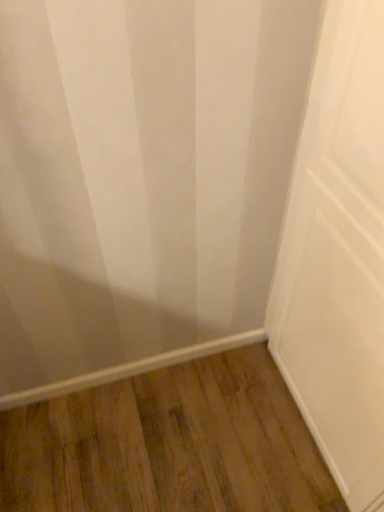
Question: From a real-world perspective, is brown wood flooring at lower center above or below white matte door at center?

Choices:
 (A) below
 (B) above

Answer: (A)

Question: Would you say brown wood flooring at lower center is to the left or to the right of white matte door at center in the picture?

Choices:
 (A) left
 (B) right

Answer: (A)

Question: Is brown wood flooring at lower center wider or thinner than white matte door at center?

Choices:
 (A) thin
 (B) wide

Answer: (B)

Question: Considering the positions of white matte door at center and brown wood flooring at lower center in the image, is white matte door at center bigger or smaller than brown wood flooring at lower center?

Choices:
 (A) small
 (B) big

Answer: (B)

Question: Is white matte door at center wider or thinner than brown wood flooring at lower center?

Choices:
 (A) thin
 (B) wide

Answer: (A)

Question: Is point (360, 148) positioned closer to the camera than point (283, 428)?

Choices:
 (A) closer
 (B) farther

Answer: (A)

Question: From a real-world perspective, is white matte door at center above or below brown wood flooring at lower center?

Choices:
 (A) above
 (B) below

Answer: (A)